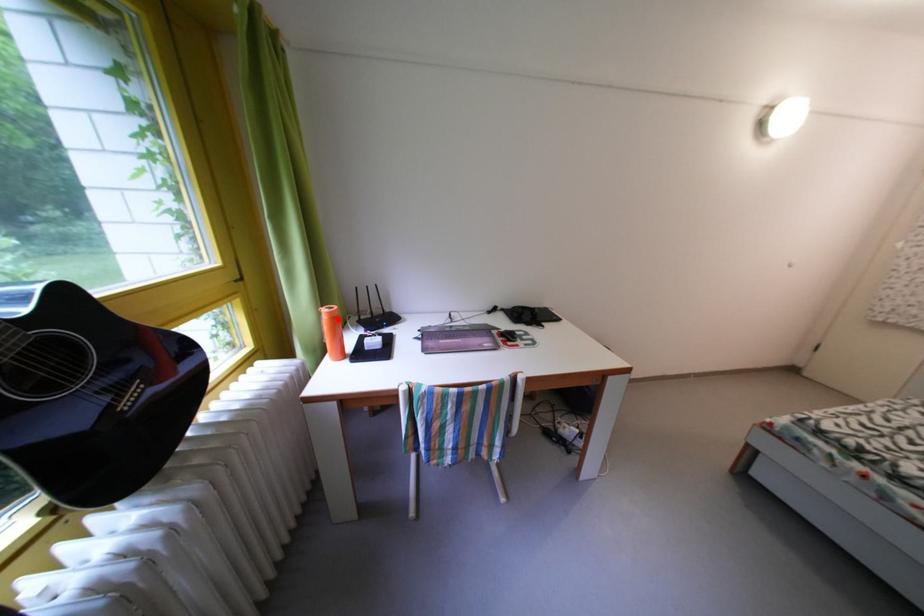
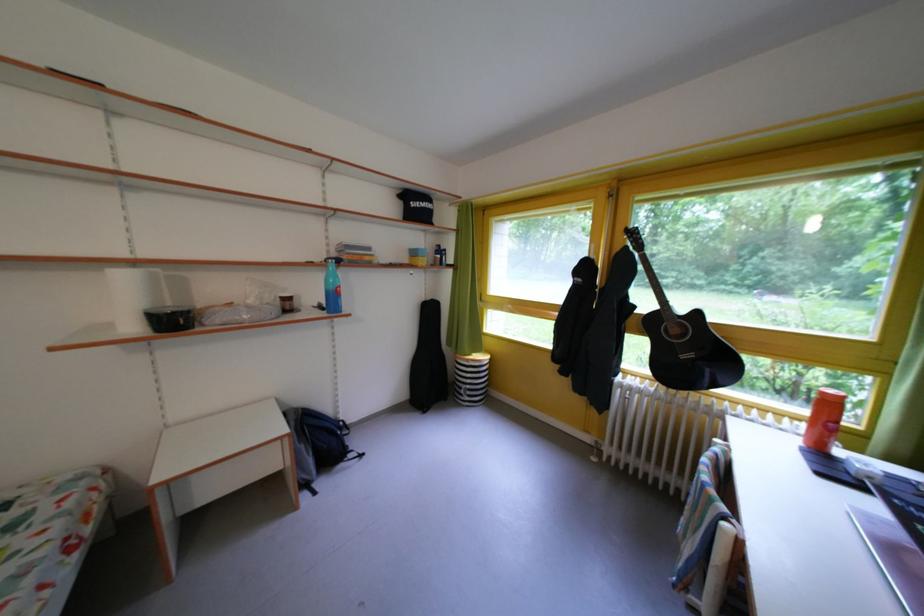
Question: I am providing you with two images of the same scene from different viewpoints. Image1 has a red point marked. In image2, the corresponding 3D location appears at what relative position? Reply with the corresponding letter.

Choices:
 (A) Closer
 (B) Farther

Answer: (B)